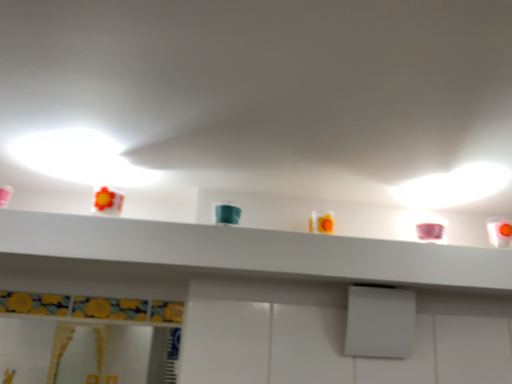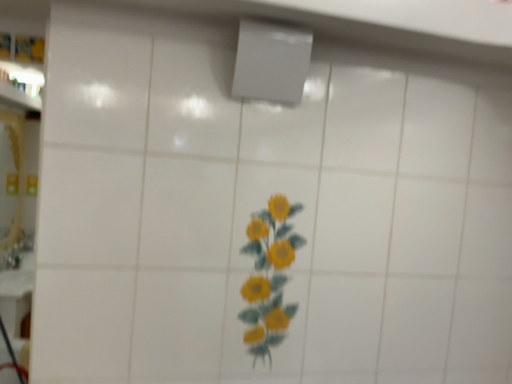
Question: Which way did the camera rotate in the video?

Choices:
 (A) rotated upward
 (B) rotated downward

Answer: (B)